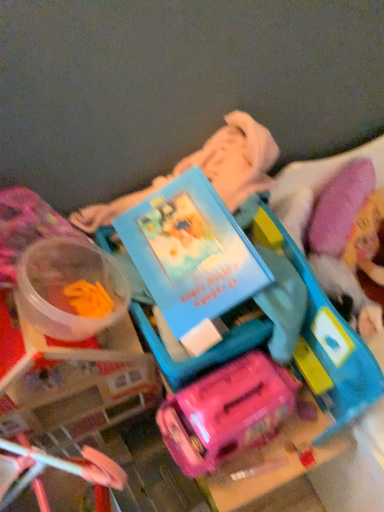
Question: Is matte blue book at center further to camera compared to translucent plastic container at left, which is counted as the 2th toy, starting from the right?

Choices:
 (A) no
 (B) yes

Answer: (A)

Question: From a real-world perspective, is matte blue book at center under translucent plastic container at left, arranged as the 1th toy when viewed from the left?

Choices:
 (A) yes
 (B) no

Answer: (B)

Question: Is matte blue book at center beside translucent plastic container at left, which is counted as the 2th toy, starting from the right?

Choices:
 (A) yes
 (B) no

Answer: (B)

Question: Can you confirm if matte blue book at center is shorter than translucent plastic container at left, which is counted as the 2th toy, starting from the right?

Choices:
 (A) yes
 (B) no

Answer: (B)

Question: From the image's perspective, would you say matte blue book at center is shown under translucent plastic container at left, arranged as the 1th toy when viewed from the left?

Choices:
 (A) no
 (B) yes

Answer: (A)

Question: Considering the relative positions of translucent plastic container at left, arranged as the 1th toy when viewed from the left, and matte blue book at center in the image provided, is translucent plastic container at left, arranged as the 1th toy when viewed from the left, to the left or to the right of matte blue book at center?

Choices:
 (A) left
 (B) right

Answer: (A)

Question: Considering the positions of translucent plastic container at left, arranged as the 1th toy when viewed from the left, and matte blue book at center in the image, is translucent plastic container at left, arranged as the 1th toy when viewed from the left, taller or shorter than matte blue book at center?

Choices:
 (A) short
 (B) tall

Answer: (A)

Question: Do you think translucent plastic container at left, which is counted as the 2th toy, starting from the right, is within matte blue book at center, or outside of it?

Choices:
 (A) inside
 (B) outside

Answer: (B)

Question: From a real-world perspective, is translucent plastic container at left, arranged as the 1th toy when viewed from the left, positioned above or below matte blue book at center?

Choices:
 (A) above
 (B) below

Answer: (B)

Question: Considering the positions of matte plastic suitcase at center, the first toy in the right-to-left sequence, and translucent plastic container at left, arranged as the 1th toy when viewed from the left, in the image, is matte plastic suitcase at center, the first toy in the right-to-left sequence, bigger or smaller than translucent plastic container at left, arranged as the 1th toy when viewed from the left,?

Choices:
 (A) big
 (B) small

Answer: (A)

Question: Considering the positions of point (297, 267) and point (41, 250), is point (297, 267) closer or farther from the camera than point (41, 250)?

Choices:
 (A) farther
 (B) closer

Answer: (B)

Question: Is matte plastic suitcase at center, which is the second toy from left to right, situated inside translucent plastic container at left, arranged as the 1th toy when viewed from the left, or outside?

Choices:
 (A) inside
 (B) outside

Answer: (B)

Question: Is matte plastic suitcase at center, the first toy in the right-to-left sequence, in front of or behind translucent plastic container at left, which is counted as the 2th toy, starting from the right, in the image?

Choices:
 (A) front
 (B) behind

Answer: (A)

Question: Is translucent plastic container at left, which is counted as the 2th toy, starting from the right, spatially inside matte plastic suitcase at center, which is the second toy from left to right, or outside of it?

Choices:
 (A) outside
 (B) inside

Answer: (A)

Question: In the image, is translucent plastic container at left, arranged as the 1th toy when viewed from the left, on the left side or the right side of matte plastic suitcase at center, the first toy in the right-to-left sequence?

Choices:
 (A) right
 (B) left

Answer: (B)